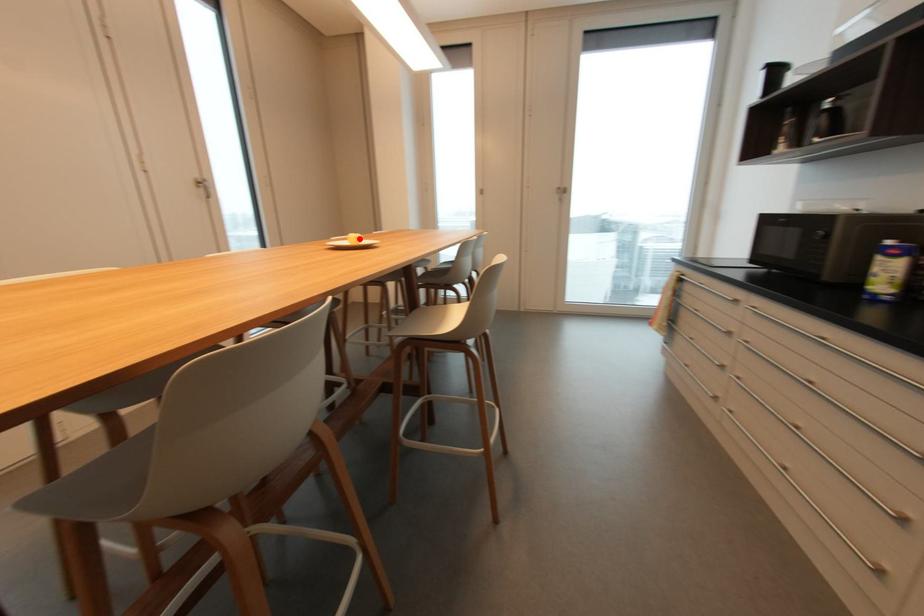
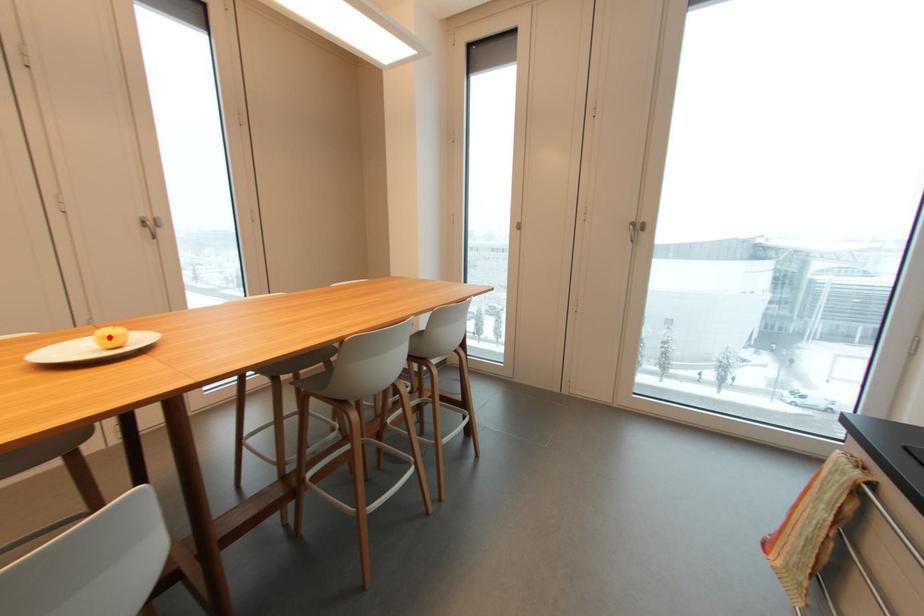
I am providing you with two images of the same scene from different viewpoints. A red point is marked on the first image and another point is marked on the second image. Is the red point in image1 aligned with the point shown in image2?

Yes